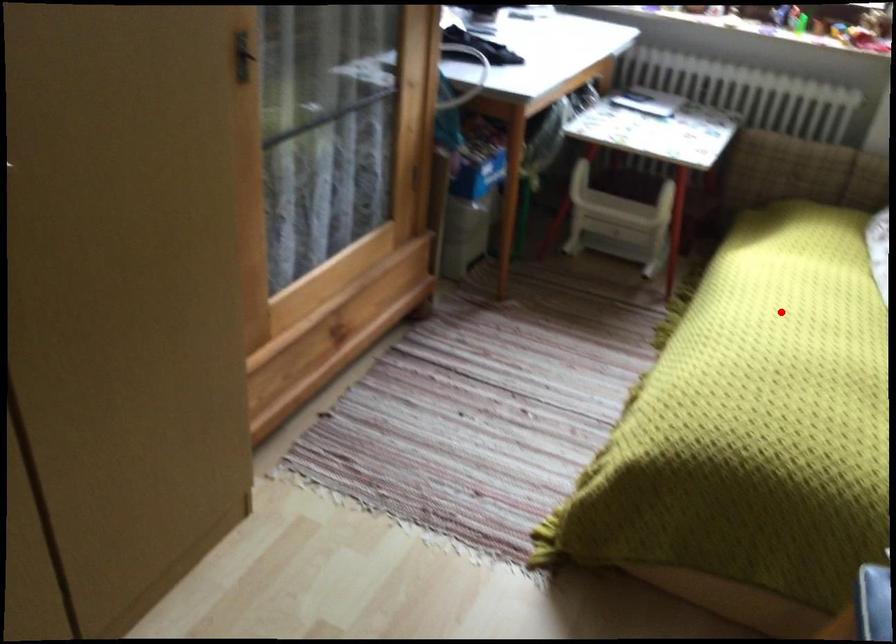
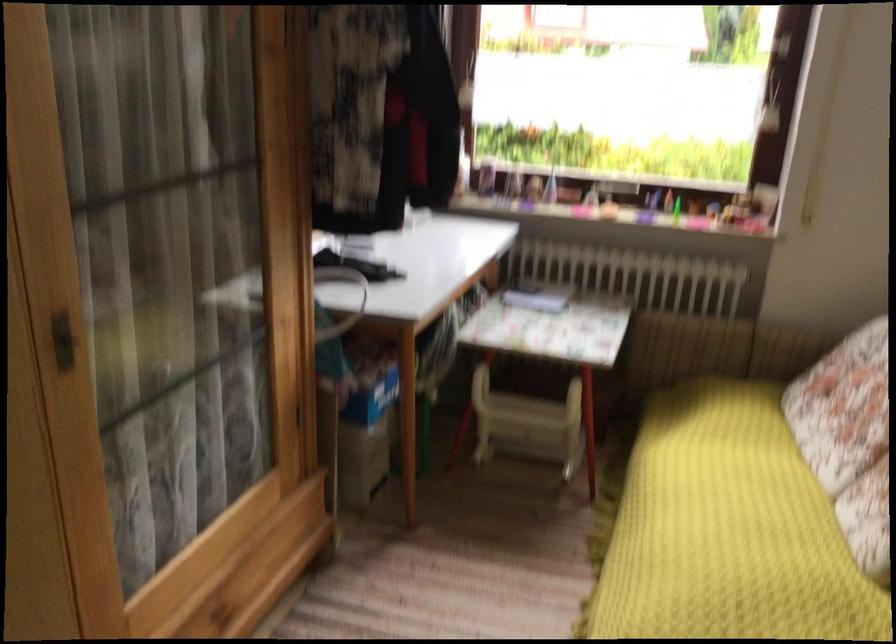
Find the pixel in the second image that matches the highlighted location in the first image.

(728, 529)